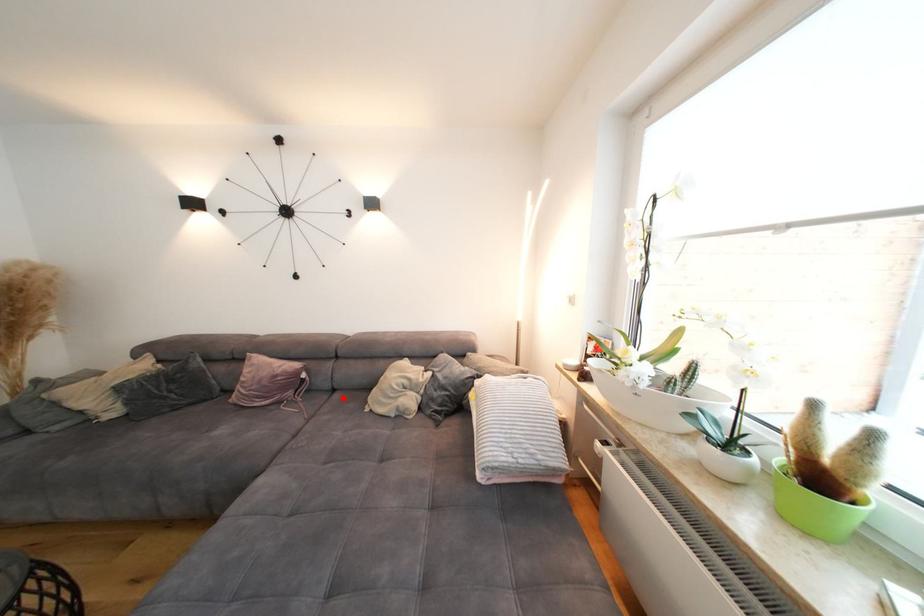
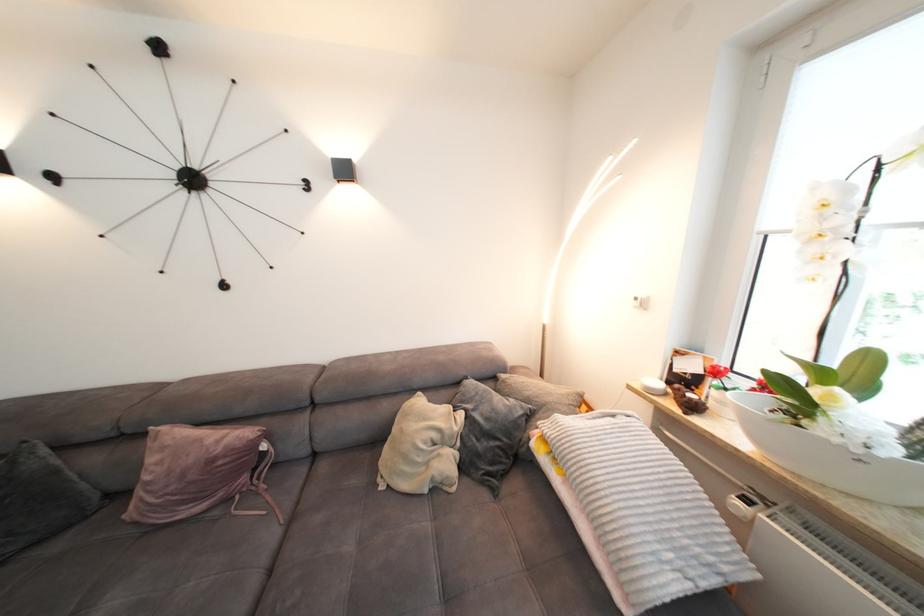
The point at the highlighted location is marked in the first image. Where is the corresponding point in the second image?

(330, 469)